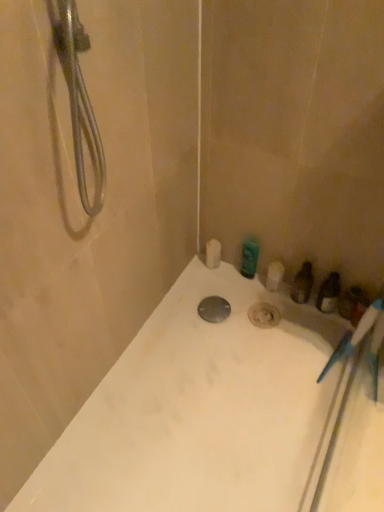
At what (x,y) coordinates should I click in order to perform the action: click on free space to the left of translucent plastic bottle at right, which ranks as the 1th toiletry in right-to-left order. Please return your answer as a coordinate pair (x, y). Image resolution: width=384 pixels, height=512 pixels. Looking at the image, I should click on (292, 325).